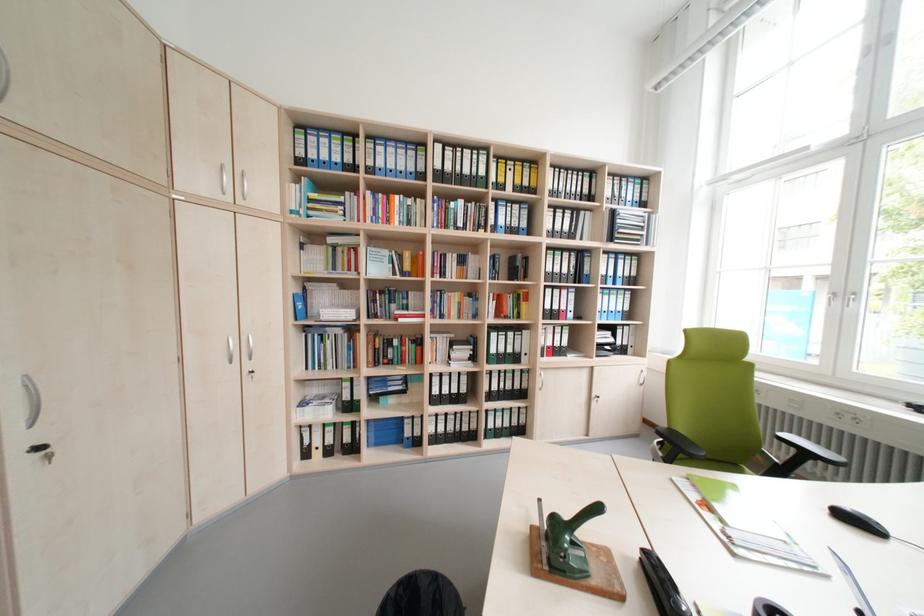
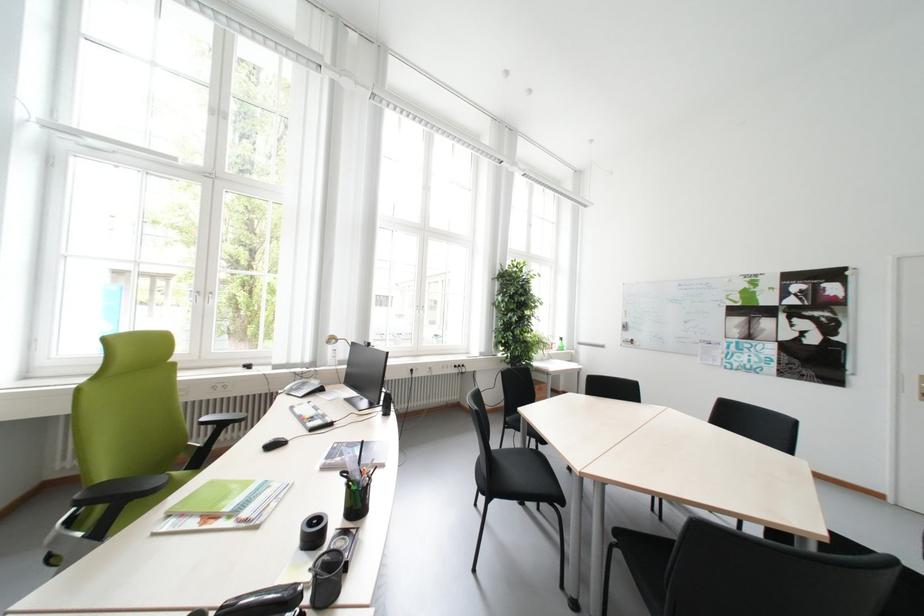
Question: The images are taken continuously from a first-person perspective. In which direction is your viewpoint rotating?

Choices:
 (A) Left
 (B) Right
 (C) Up
 (D) Down

Answer: (B)